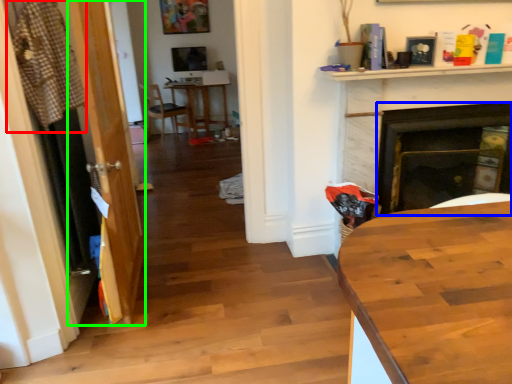
Question: Which object is the closest to the laundry (highlighted by a red box)? Choose among these: fireplace (highlighted by a blue box) or glass door (highlighted by a green box).

Choices:
 (A) fireplace
 (B) glass door

Answer: (B)